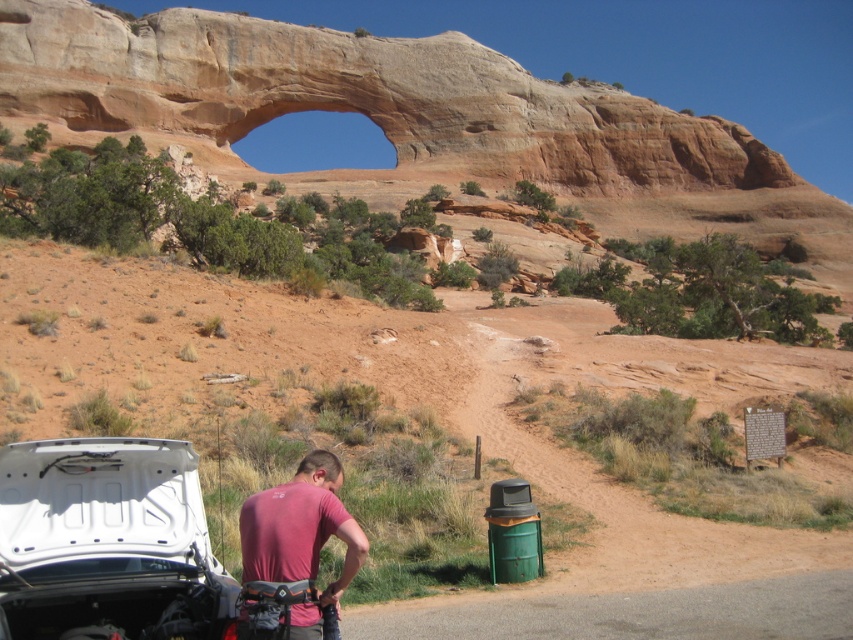
Who is shorter, white matte car at lower left or pink fabric shirt at lower center?

With less height is white matte car at lower left.

Find the location of a particular element. white matte car at lower left is located at coordinates (107, 541).

Where is `white matte car at lower left`? white matte car at lower left is located at coordinates (107, 541).